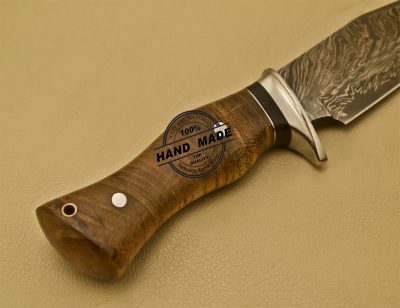
Image resolution: width=400 pixels, height=308 pixels. I want to click on wooden handle, so click(154, 168).